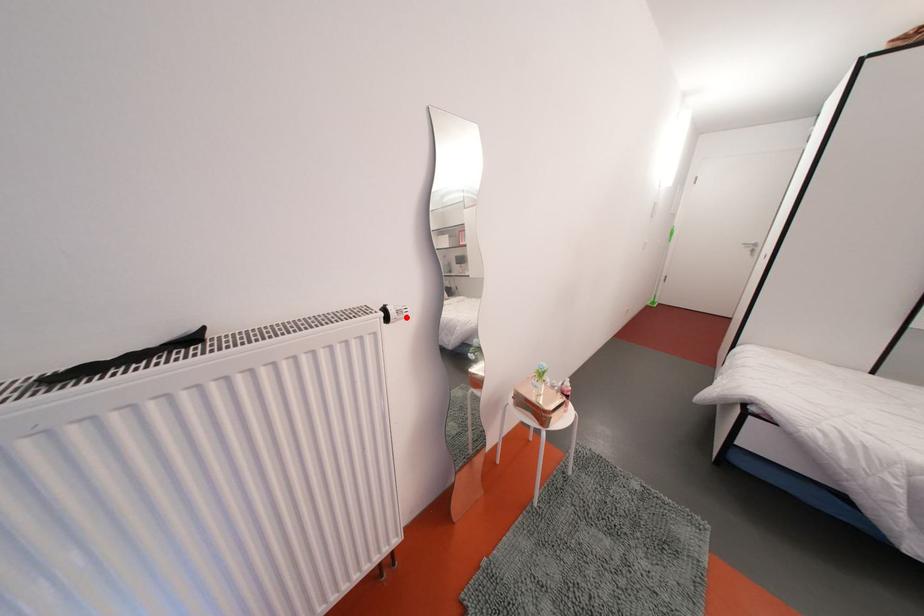
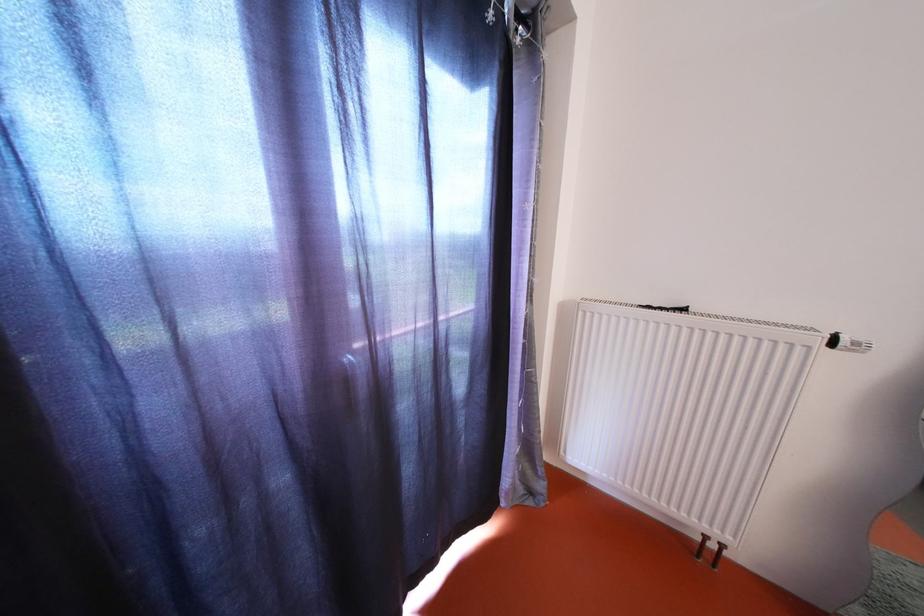
Locate, in the second image, the point that corresponds to the highlighted location in the first image.

(862, 349)